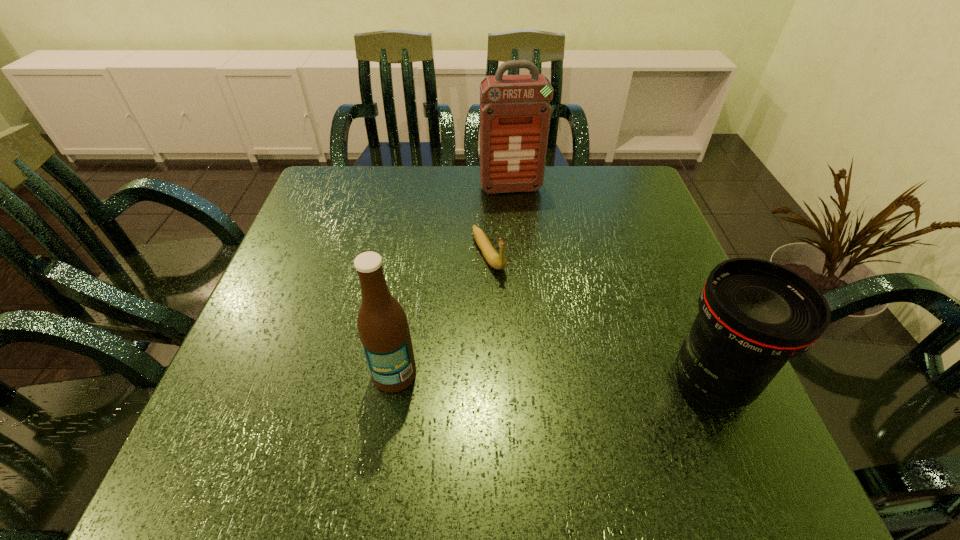
Identify the location of vacant space on the desktop that is between the beer bottle and the telephoto lens and is positioned on the front-facing side of the farthest object. Image resolution: width=960 pixels, height=540 pixels. (558, 377).

This screenshot has width=960, height=540. What are the coordinates of `vacant space on the desktop that is between the third shortest object and the rightmost object and is positioned at the stem of the second farthest object` in the screenshot? It's located at (566, 378).